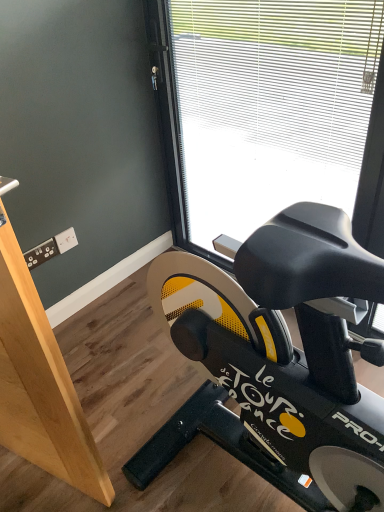
This screenshot has height=512, width=384. What are the coordinates of `vacant space behind light brown wood at left` in the screenshot? It's located at (105, 372).